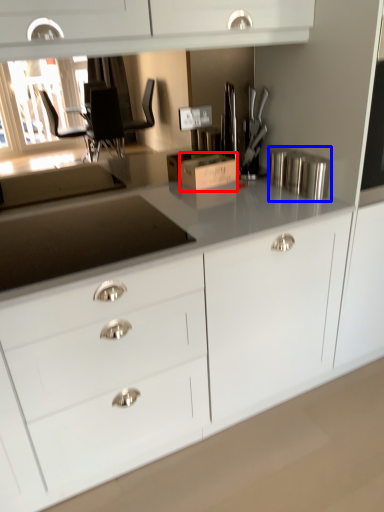
Question: Which of the following is the closest to the observer, cardboard box (highlighted by a red box) or appliance (highlighted by a blue box)?

Choices:
 (A) cardboard box
 (B) appliance

Answer: (B)